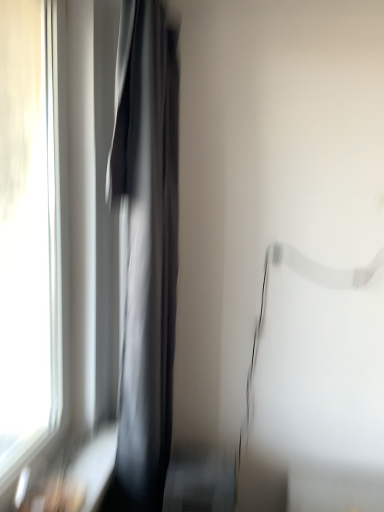
Locate an element on the screen. The height and width of the screenshot is (512, 384). black matte curtain at left is located at coordinates (145, 250).

Describe the element at coordinates (145, 250) in the screenshot. I see `black matte curtain at left` at that location.

Where is `black matte curtain at left`? The height and width of the screenshot is (512, 384). black matte curtain at left is located at coordinates (145, 250).